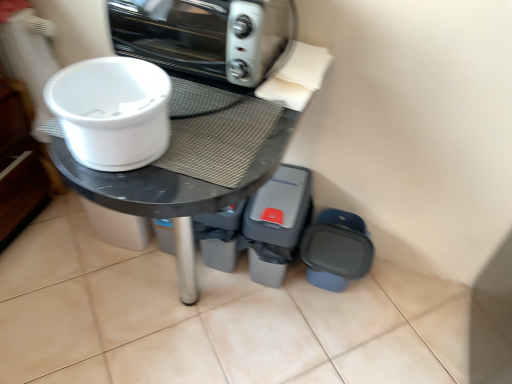
Locate an element on the screen. vacant point to the right of matte plastic container at lower right, the second appliance viewed from the left is located at coordinates (390, 301).